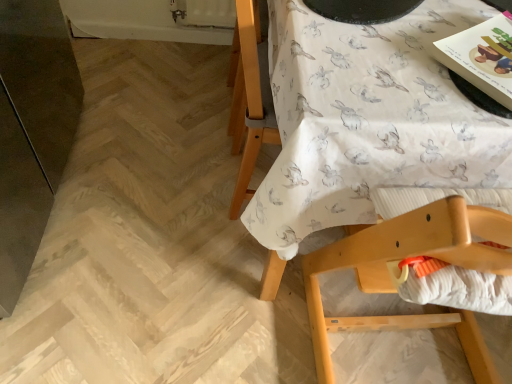
Image resolution: width=512 pixels, height=384 pixels. In order to click on vacant area that lies between white fabric with rabbit print at upper right and wooden highchair at upper right in this screenshot , I will do `click(346, 359)`.